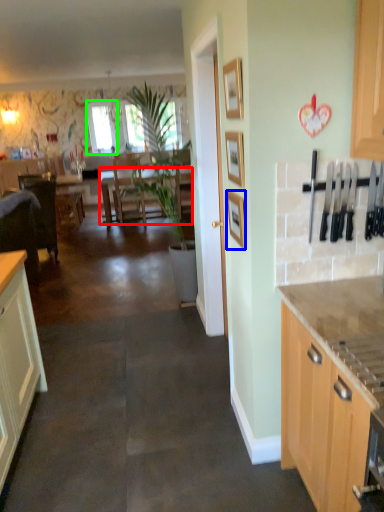
Question: Which object is the farthest from table (highlighted by a red box)? Choose among these: picture frame (highlighted by a blue box) or window screen (highlighted by a green box).

Choices:
 (A) picture frame
 (B) window screen

Answer: (A)